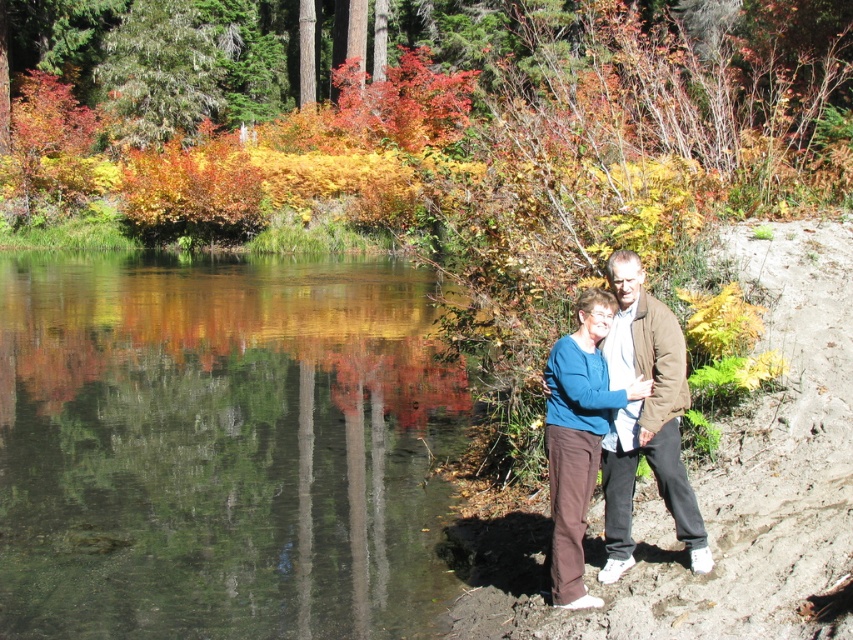
Does clear water at center have a greater height compared to blue sweater at center?

Yes, clear water at center is taller than blue sweater at center.

Who is higher up, clear water at center or blue sweater at center?

clear water at center

Who is more distant from viewer, (128,624) or (682,536)?

The point (128,624) is behind.

Locate an element on the screen. The width and height of the screenshot is (853, 640). clear water at center is located at coordinates (222, 445).